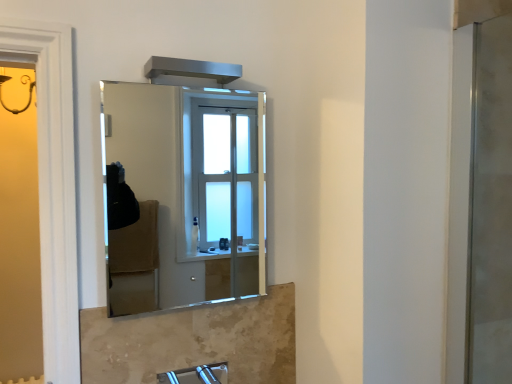
Question: From the image's perspective, is clear glass mirror at center located above satin nickel faucet at lower center?

Choices:
 (A) no
 (B) yes

Answer: (B)

Question: Is clear glass mirror at center shorter than satin nickel faucet at lower center?

Choices:
 (A) no
 (B) yes

Answer: (A)

Question: Is clear glass mirror at center positioned with its back to satin nickel faucet at lower center?

Choices:
 (A) yes
 (B) no

Answer: (B)

Question: Is there a large distance between clear glass mirror at center and satin nickel faucet at lower center?

Choices:
 (A) yes
 (B) no

Answer: (A)

Question: Is clear glass mirror at center not within satin nickel faucet at lower center?

Choices:
 (A) no
 (B) yes

Answer: (B)

Question: Considering the relative sizes of clear glass mirror at center and satin nickel faucet at lower center in the image provided, is clear glass mirror at center taller than satin nickel faucet at lower center?

Choices:
 (A) no
 (B) yes

Answer: (B)

Question: Is clear glass screen door at right positioned in front of satin nickel faucet at lower center?

Choices:
 (A) no
 (B) yes

Answer: (A)

Question: Can you confirm if clear glass screen door at right is shorter than satin nickel faucet at lower center?

Choices:
 (A) no
 (B) yes

Answer: (A)

Question: Does clear glass screen door at right have a smaller size compared to satin nickel faucet at lower center?

Choices:
 (A) no
 (B) yes

Answer: (A)

Question: From a real-world perspective, is clear glass screen door at right under satin nickel faucet at lower center?

Choices:
 (A) no
 (B) yes

Answer: (A)

Question: Is clear glass screen door at right thinner than satin nickel faucet at lower center?

Choices:
 (A) yes
 (B) no

Answer: (A)

Question: Is the depth of clear glass screen door at right greater than that of satin nickel faucet at lower center?

Choices:
 (A) yes
 (B) no

Answer: (A)

Question: Is satin nickel faucet at lower center further to camera compared to clear glass mirror at center?

Choices:
 (A) no
 (B) yes

Answer: (A)